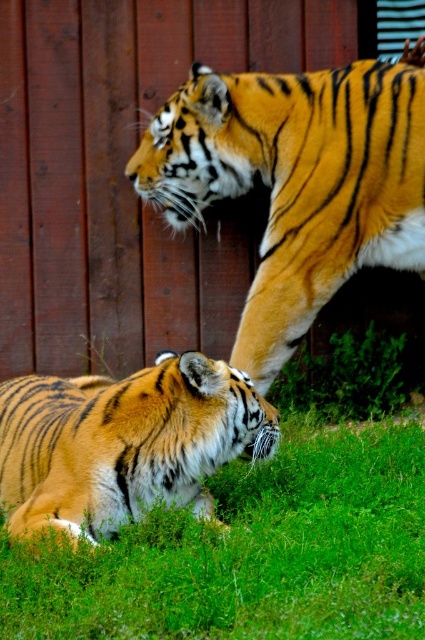
You are a zookeeper standing at the center of the enclosure. You need to place a new feeding bowl for the tiger lying on the green grass at lower center. Where should you place the bowl relative to the tiger?

The feeding bowl should be placed near the green grass at lower center where the tiger is lying, specifically at coordinates approximately 0.866 on the x axis and 0.588 on the y axis.